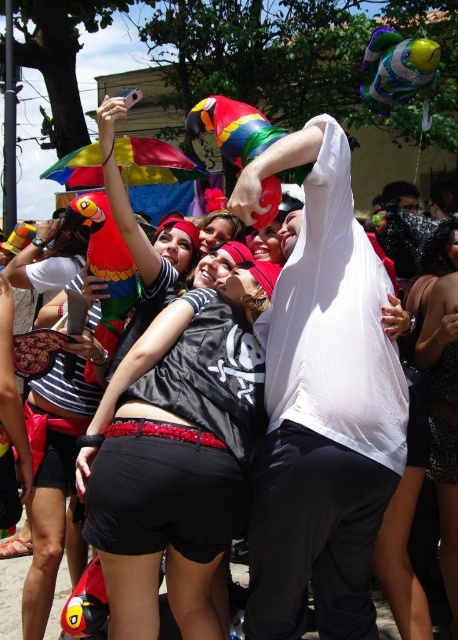
You are a photographer trying to capture the festive scene. You notice the black matte shorts at center and the matte black shirt at center. Based on their positions, which one should you focus on first if you want to frame them from top to bottom?

The matte black shirt at center is located above the black matte shorts at center, so you should focus on the matte black shirt at center first when framing from top to bottom.

You are standing in the crowd at the festive event and want to take a photo of both the point at coordinates point [441,342] and point [206,220]. Since you can only focus on one point at a time, which point should you focus on to ensure the other point remains in the background?

You should focus on point [441,342] because it is closer to the camera than point [206,220]. By focusing on the closer point, the farther point will naturally be in the background.

You are a photographer at the event and want to capture a photo that includes both the black satin dress at lower right and the matte black shirt at center. Which object should you focus on first to ensure both are in the frame?

The black satin dress at lower right is below the matte black shirt at center, so you should focus on the matte black shirt at center first to ensure both are in the frame.